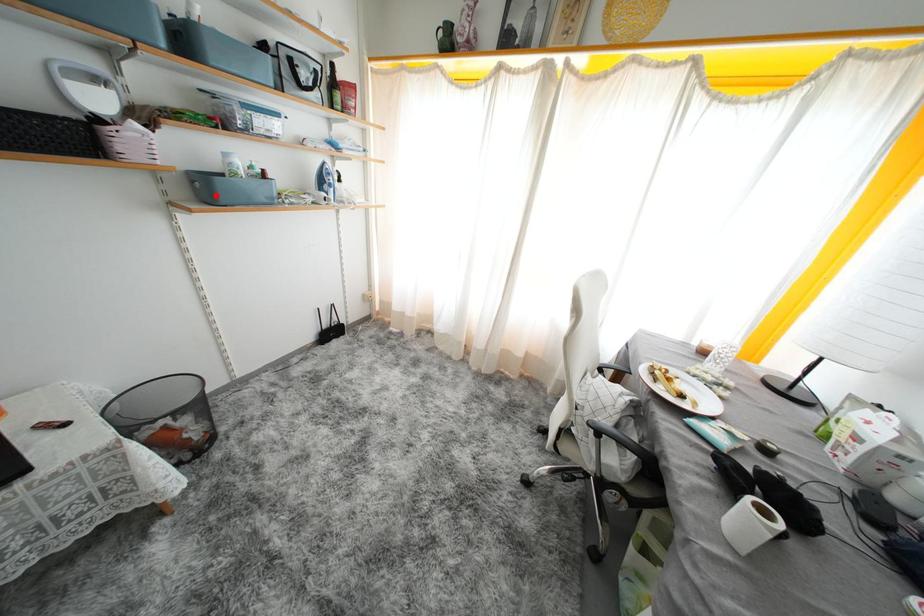
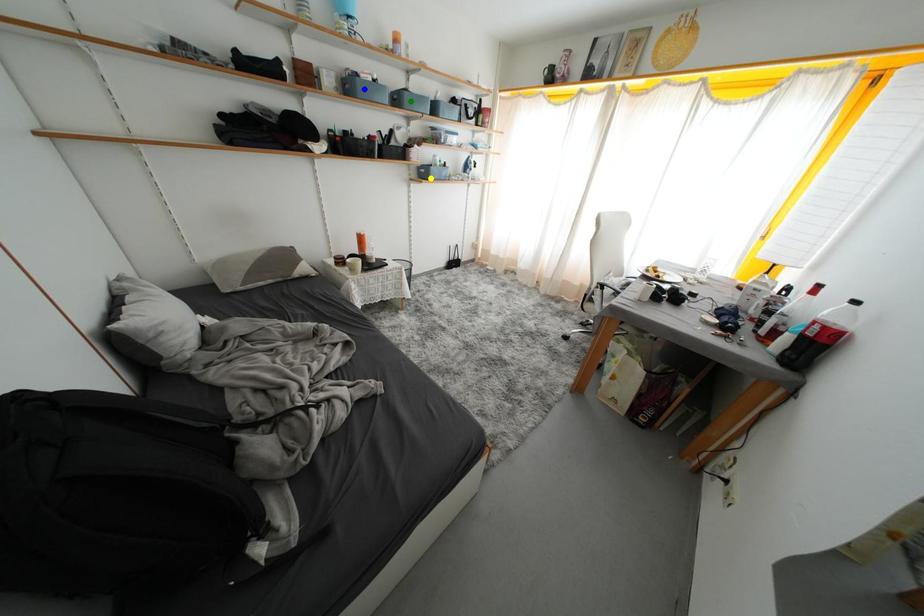
Question: I am providing you with two images of the same scene from different viewpoints. A red point is marked on the first image. You are given multiple points on the second image. Can you choose the point in image 2 that corresponds to the point in image 1?

Choices:
 (A) yellow point
 (B) green point
 (C) blue point

Answer: (A)